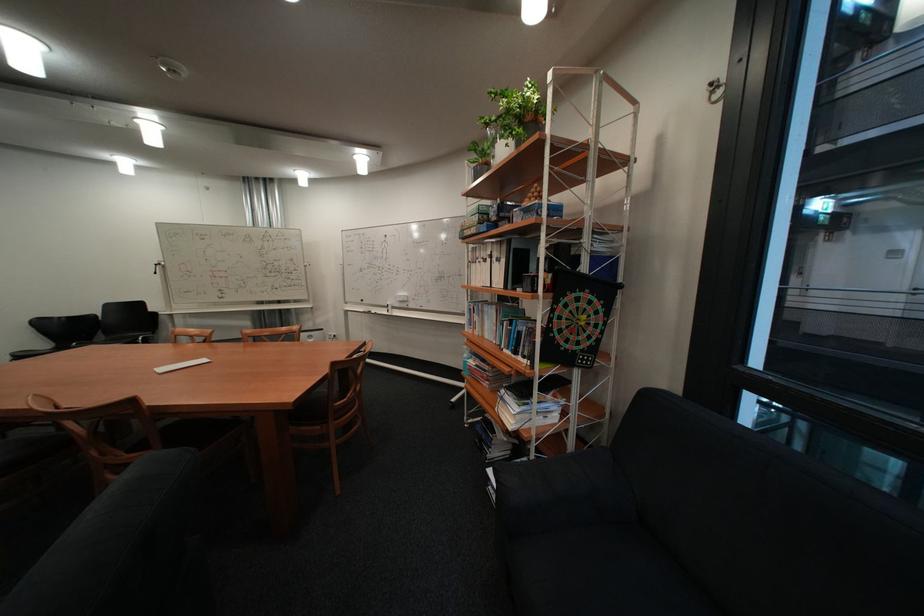
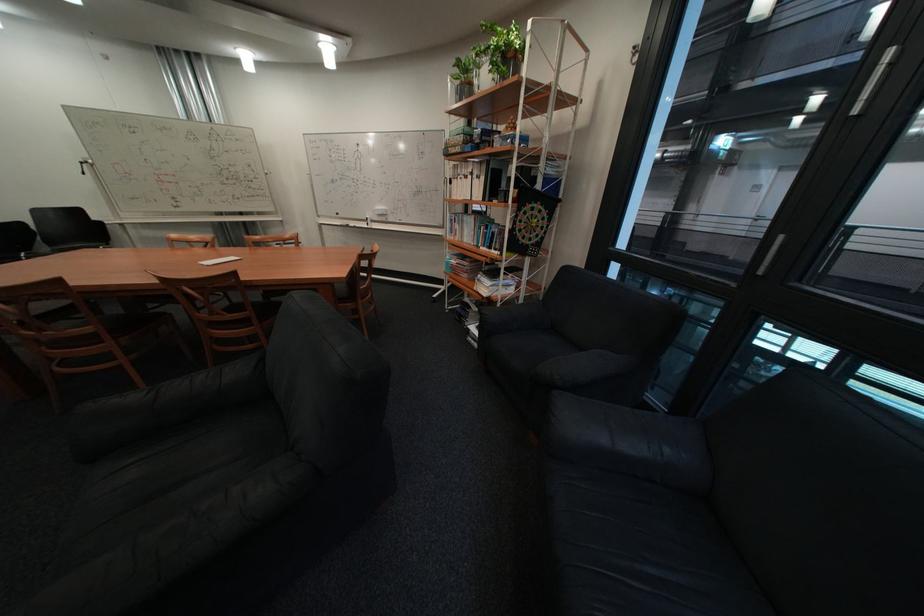
The point at (x=138, y=454) is marked in the first image. Where is the corresponding point in the second image?

(240, 314)